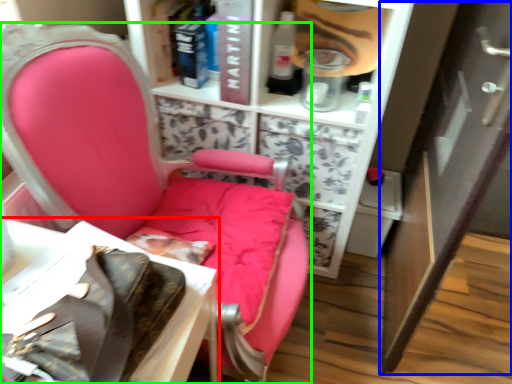
Question: Which object is the farthest from table (highlighted by a red box)? Choose among these: cabinetry (highlighted by a blue box) or chair (highlighted by a green box).

Choices:
 (A) cabinetry
 (B) chair

Answer: (A)